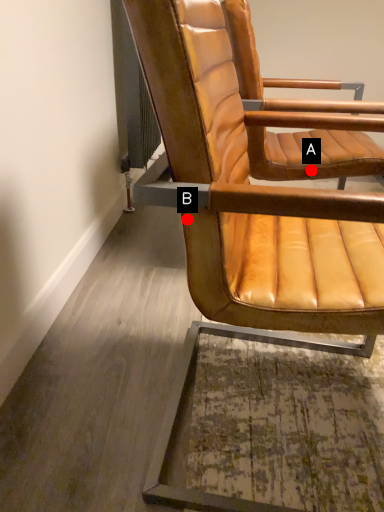
Question: Two points are circled on the image, labeled by A and B beside each circle. Which point is farther to the camera?

Choices:
 (A) A is further
 (B) B is further

Answer: (A)